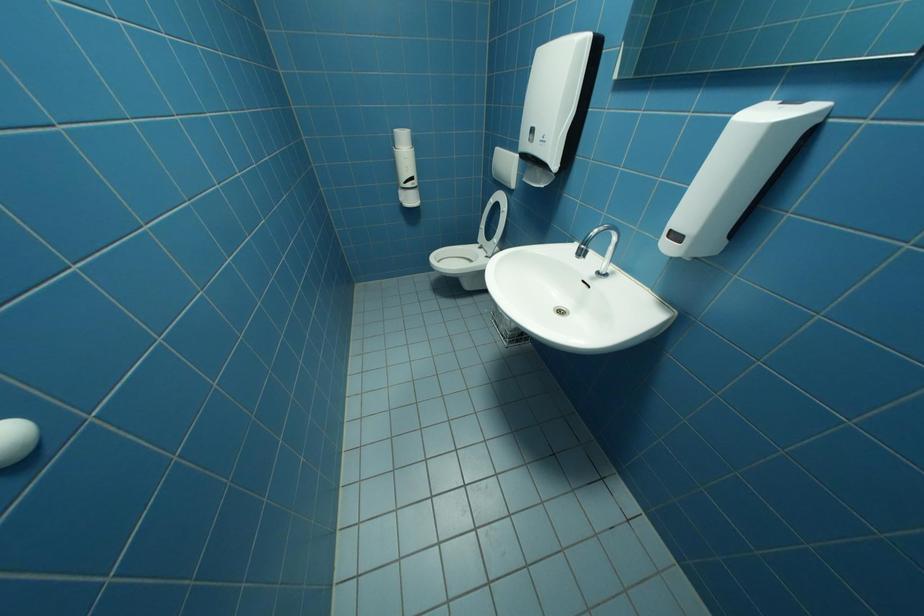
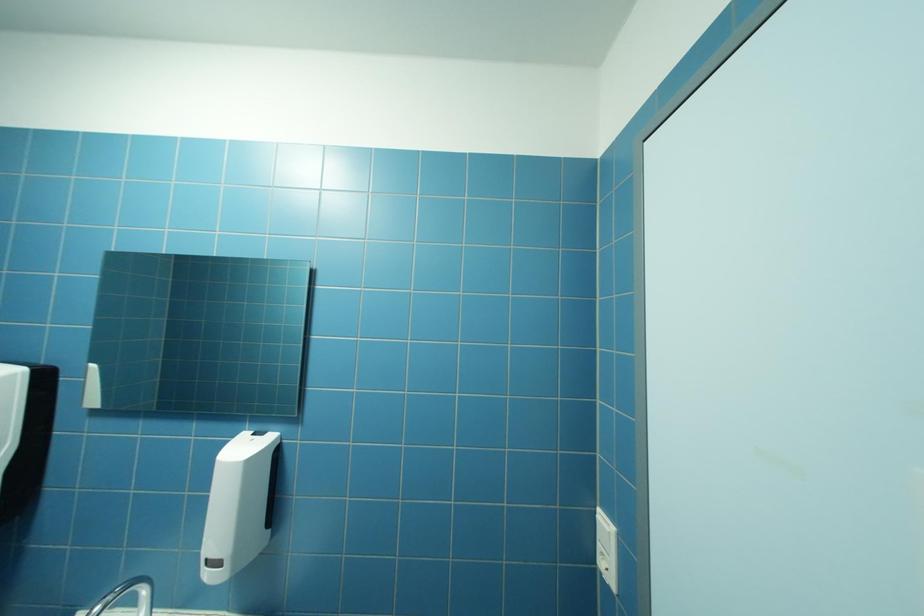
Question: The camera is either moving clockwise (left) or counter-clockwise (right) around the object. The first image is from the beginning of the video and the second image is from the end. Is the camera moving left or right when shooting the video?

Choices:
 (A) Left
 (B) Right

Answer: (A)